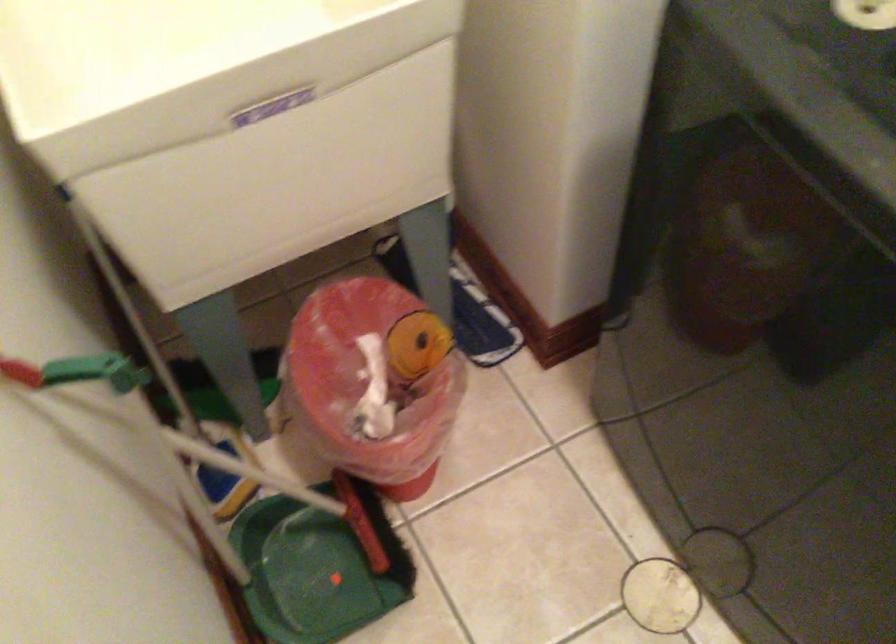
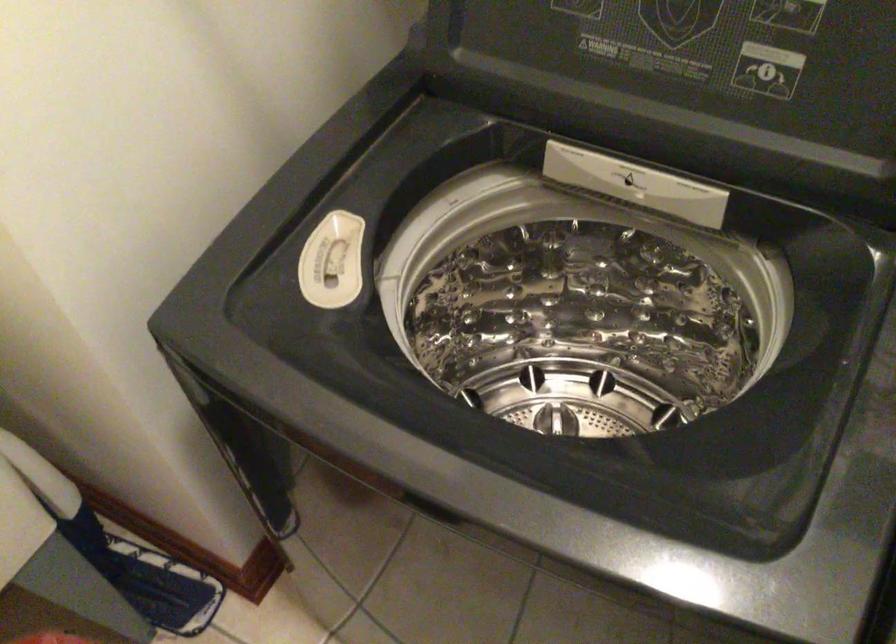
Question: The images are taken continuously from a first-person perspective. In which direction is your viewpoint rotating?

Choices:
 (A) Left
 (B) Right
 (C) Up
 (D) Down

Answer: (B)